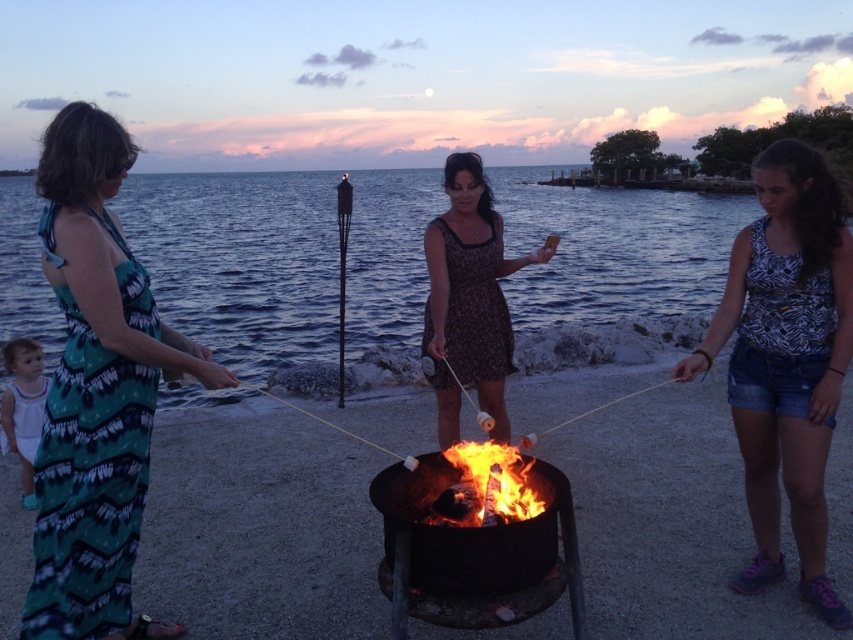
You are a photographer trying to capture the scene of the beach fire pit. You want to ensure both the brown floral dress at center and the flaming wood at center are clearly visible in your photo. Which object should you focus on first to ensure proper exposure, considering their sizes?

The brown floral dress at center is bigger than the flaming wood at center, so focusing on the larger brown floral dress at center first will help balance the exposure for both objects in the photo.

You are a photographer at the beach scene described. You need to capture a photo that includes both the teal printed dress at left and the white cotton dress at lower left. Which dress should be placed more to the left in the frame to match the original scene?

The teal printed dress at left should be placed more to the left in the frame because it is positioned on the left side of the white cotton dress at lower left in the original scene.